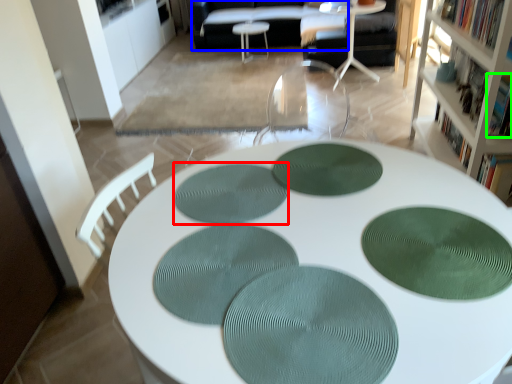
Question: Considering the real-world distances, which object is closest to mat (highlighted by a red box)? couch (highlighted by a blue box) or book (highlighted by a green box).

Choices:
 (A) couch
 (B) book

Answer: (B)